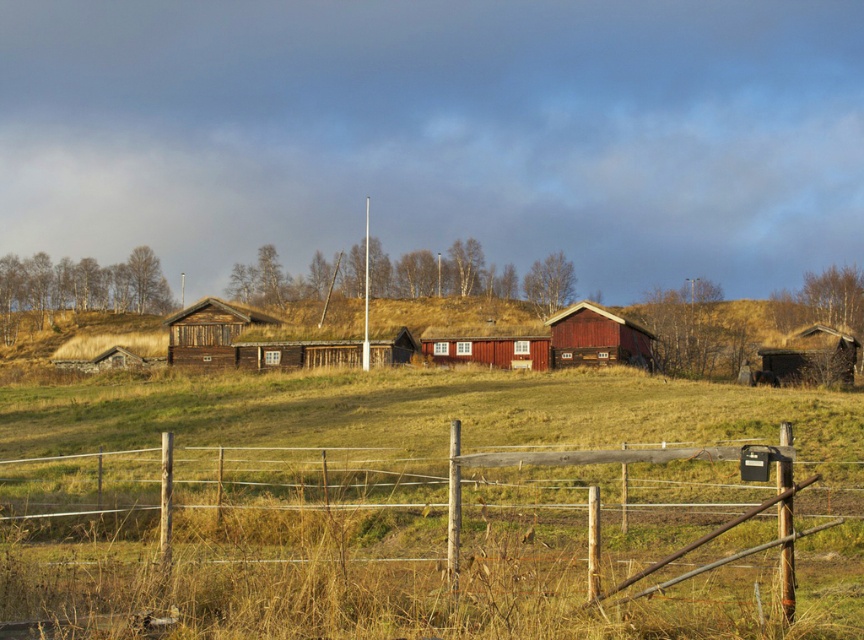
Is the position of red wooden barn at center less distant than that of matte wooden hut at center?

Yes, it is in front of matte wooden hut at center.

Between red wooden barn at center and matte wooden hut at center, which one is positioned higher?

red wooden barn at center

In order to click on red wooden barn at center in this screenshot , I will do `click(596, 339)`.

Who is taller, wooden gate at lower center or red wooden barn at center?

Standing taller between the two is wooden gate at lower center.

Is wooden gate at lower center above red wooden barn at center?

No, wooden gate at lower center is not above red wooden barn at center.

Locate an element on the screen. This screenshot has width=864, height=640. wooden gate at lower center is located at coordinates (414, 552).

Locate an element on the screen. The image size is (864, 640). wooden gate at lower center is located at coordinates (414, 552).

Which is in front, point (818, 621) or point (446, 339)?

Point (818, 621)

At what (x,y) coordinates should I click in order to perform the action: click on wooden gate at lower center. Please return your answer as a coordinate pair (x, y). Looking at the image, I should click on (414, 552).